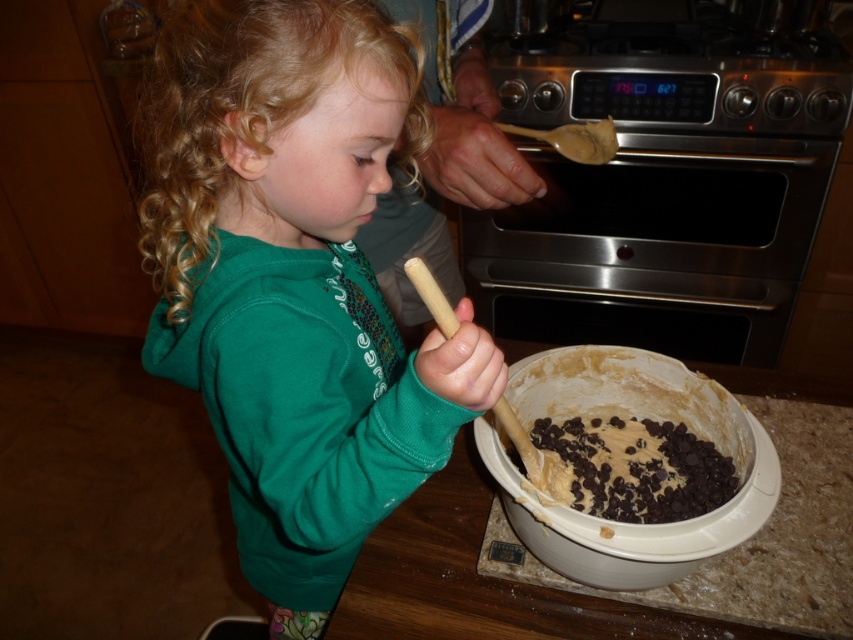
Question: Does green matte hoodie at center have a lesser width compared to white plastic bowl at lower center?

Choices:
 (A) no
 (B) yes

Answer: (A)

Question: Estimate the real-world distances between objects in this image. Which object is farther from the white plastic bowl at lower center?

Choices:
 (A) green matte hoodie at center
 (B) stainless steel oven at upper center
 (C) dark chocolate chips at center
 (D) dark brown dough at center

Answer: (B)

Question: Which point is farther to the camera?

Choices:
 (A) dark chocolate chips at center
 (B) green matte hoodie at center
 (C) stainless steel oven at upper center

Answer: (C)

Question: Is the position of green matte hoodie at center less distant than that of dark chocolate chips at center?

Choices:
 (A) yes
 (B) no

Answer: (A)

Question: Can you confirm if stainless steel oven at upper center is positioned to the right of dark brown dough at center?

Choices:
 (A) yes
 (B) no

Answer: (A)

Question: Which point is closer to the camera taking this photo?

Choices:
 (A) (531, 198)
 (B) (692, 456)

Answer: (B)